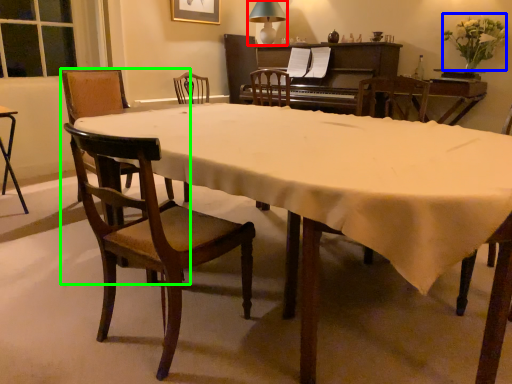
Question: Which object is the closest to the lamp (highlighted by a red box)? Choose among these: flower (highlighted by a blue box) or chair (highlighted by a green box).

Choices:
 (A) flower
 (B) chair

Answer: (A)